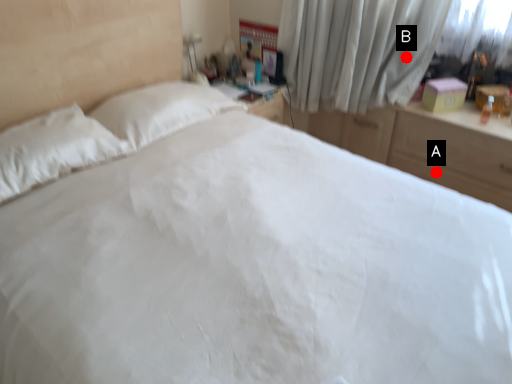
Question: Two points are circled on the image, labeled by A and B beside each circle. Which point appears farthest from the camera in this image?

Choices:
 (A) A is further
 (B) B is further

Answer: (B)